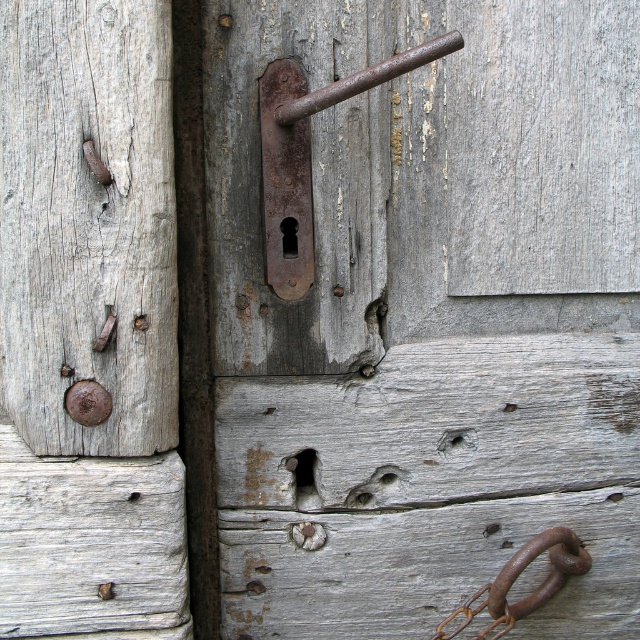
Question: Which is farther from the rusty metal handle at center?

Choices:
 (A) rusty metal hook at lower right
 (B) rusty metal door handle at center

Answer: (A)

Question: In this image, where is rusty metal door handle at center located relative to rusty metal hook at lower right?

Choices:
 (A) above
 (B) below

Answer: (A)

Question: Which point appears closest to the camera in this image?

Choices:
 (A) [61, 216]
 (B) [296, 224]
 (C) [465, 602]

Answer: (A)

Question: Does rusty metal handle at center have a smaller size compared to rusty metal door handle at center?

Choices:
 (A) no
 (B) yes

Answer: (A)

Question: Which point appears closest to the camera in this image?

Choices:
 (A) (228, 109)
 (B) (282, 164)

Answer: (B)

Question: Is rusty metal handle at center to the left of rusty metal door handle at center from the viewer's perspective?

Choices:
 (A) yes
 (B) no

Answer: (B)